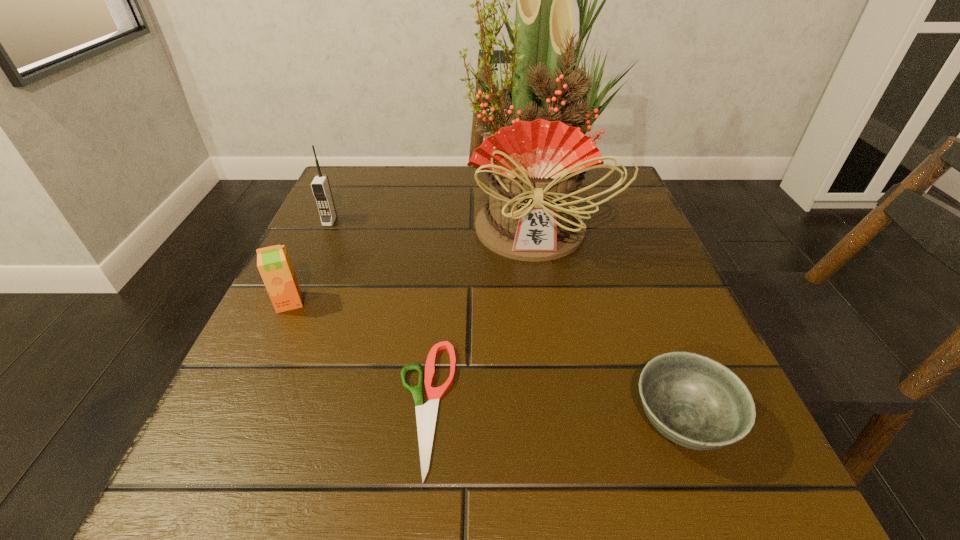
Identify the location of object that stands as the fourth closest to the second shortest object. (320, 185).

Identify the location of vacant space that satisfies the following two spatial constraints: 1. on the front-facing side of the fourth shortest object; 2. on the right side of the shortest object. The image size is (960, 540). (246, 406).

Locate an element on the screen. vacant region that satisfies the following two spatial constraints: 1. on the front side of the shortest object; 2. on the right side of the orange juice is located at coordinates (241, 406).

Image resolution: width=960 pixels, height=540 pixels. I want to click on free space that satisfies the following two spatial constraints: 1. on the front side of the third nearest object; 2. on the left side of the shortest object, so click(x=241, y=406).